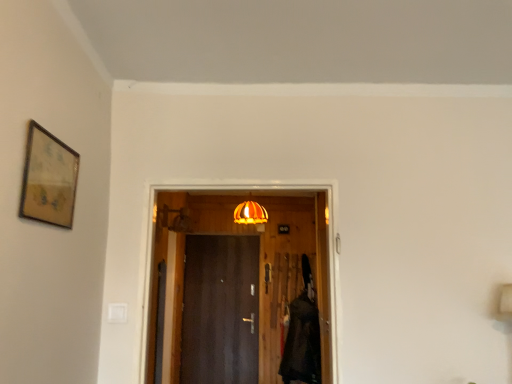
At what (x,y) coordinates should I click in order to perform the action: click on wooden-framed artwork at upper left. Please return your answer as a coordinate pair (x, y). This screenshot has width=512, height=384. Looking at the image, I should click on (49, 179).

From a real-world perspective, is dark wood door at center, the first door from the bottom, positioned above or below wooden door at center, the second door when ordered from bottom to top?

Clearly, from a real-world perspective, dark wood door at center, the first door from the bottom, is below wooden door at center, the second door when ordered from bottom to top.

Can you tell me how much dark wood door at center, acting as the 1th door starting from the back, and wooden door at center, arranged as the 1th door when viewed from the front, differ in facing direction?

1.3 degrees separate the facing orientations of dark wood door at center, acting as the 1th door starting from the back, and wooden door at center, arranged as the 1th door when viewed from the front.

Is dark wood door at center, the first door from the bottom, touching wooden door at center, the second door when ordered from bottom to top?

dark wood door at center, the first door from the bottom, and wooden door at center, the second door when ordered from bottom to top, are not in contact.

Which of these two, wooden door at center, which ranks as the first door in top-to-bottom order, or dark wood door at center, acting as the 1th door starting from the back, is thinner?

dark wood door at center, acting as the 1th door starting from the back.

How far apart are wooden door at center, the second door from the back, and dark wood door at center, acting as the 1th door starting from the back?

They are 10.91 inches apart.

Where is `door that is under the wooden door at center, the second door from the back (from a real-world perspective)`? door that is under the wooden door at center, the second door from the back (from a real-world perspective) is located at coordinates (220, 310).

Is wooden door at center, the second door when ordered from bottom to top, shorter than dark wood door at center, the 2th door when ordered from front to back?

Indeed, wooden door at center, the second door when ordered from bottom to top, has a lesser height compared to dark wood door at center, the 2th door when ordered from front to back.

Is wooden door at center, the second door when ordered from bottom to top, facing towards wooden-framed artwork at upper left?

No, wooden door at center, the second door when ordered from bottom to top, is not oriented towards wooden-framed artwork at upper left.

How many degrees apart are the facing directions of wooden door at center, the second door when ordered from bottom to top, and wooden-framed artwork at upper left?

91.2 degrees separate the facing orientations of wooden door at center, the second door when ordered from bottom to top, and wooden-framed artwork at upper left.

Does point (293, 253) lie behind point (22, 192)?

Yes, it is behind point (22, 192).

Does dark wood door at center, the first door from the bottom, have a lesser height compared to velvet black robe at right?

Incorrect, the height of dark wood door at center, the first door from the bottom, does not fall short of that of velvet black robe at right.

Could you tell me if dark wood door at center, the first door from the bottom, is turned towards velvet black robe at right?

No.

Are dark wood door at center, the 2th door when ordered from front to back, and velvet black robe at right far apart?

They are positioned close to each other.

Does wooden-framed artwork at upper left come in front of wooden door at center, the second door when ordered from bottom to top?

Yes, the depth of wooden-framed artwork at upper left is less than that of wooden door at center, the second door when ordered from bottom to top.

From the image's perspective, would you say wooden-framed artwork at upper left is positioned over wooden door at center, arranged as the 1th door when viewed from the front?

Correct, wooden-framed artwork at upper left appears higher than wooden door at center, arranged as the 1th door when viewed from the front, in the image.

Is wooden-framed artwork at upper left oriented towards wooden door at center, which ranks as the first door in top-to-bottom order?

No, wooden-framed artwork at upper left is not aimed at wooden door at center, which ranks as the first door in top-to-bottom order.

Considering the points (58, 139) and (291, 361), which point is behind, point (58, 139) or point (291, 361)?

The point (291, 361) is farther from the camera.

Where is `picture frame in front of the velvet black robe at right`? The width and height of the screenshot is (512, 384). picture frame in front of the velvet black robe at right is located at coordinates (49, 179).

In the image, is wooden-framed artwork at upper left on the left side or the right side of velvet black robe at right?

wooden-framed artwork at upper left is positioned on velvet black robe at right's left side.

How distant is wooden-framed artwork at upper left from velvet black robe at right?

The distance of wooden-framed artwork at upper left from velvet black robe at right is 3.54 meters.

Is wooden-framed artwork at upper left bigger than velvet black robe at right?

No, wooden-framed artwork at upper left is not bigger than velvet black robe at right.

Is velvet black robe at right far from wooden-framed artwork at upper left?

→ Yes, velvet black robe at right and wooden-framed artwork at upper left are quite far apart.

Visually, is velvet black robe at right positioned to the left or to the right of wooden-framed artwork at upper left?

From the image, it's evident that velvet black robe at right is to the right of wooden-framed artwork at upper left.

Would you say velvet black robe at right is outside wooden-framed artwork at upper left?

Indeed, velvet black robe at right is completely outside wooden-framed artwork at upper left.

Based on the photo, considering the sizes of objects velvet black robe at right and wooden-framed artwork at upper left in the image provided, who is wider, velvet black robe at right or wooden-framed artwork at upper left?

Wider between the two is velvet black robe at right.

Identify the location of door above the dark wood door at center, arranged as the 2th door when viewed from the top (from the image's perspective). (239, 290).

At what (x,y) coordinates should I click in order to perform the action: click on door behind the wooden door at center, which ranks as the first door in top-to-bottom order. Please return your answer as a coordinate pair (x, y). Looking at the image, I should click on (220, 310).

Which object lies further to the anchor point dark wood door at center, the first door from the bottom, wooden door at center, the second door when ordered from bottom to top, or velvet black robe at right?

Among the two, velvet black robe at right is located further to dark wood door at center, the first door from the bottom.

When comparing their distances from velvet black robe at right, does orange glass lampshade at center or wooden-framed artwork at upper left seem closer?

orange glass lampshade at center is closer to velvet black robe at right.

Looking at the image, which one is located further to wooden door at center, arranged as the 1th door when viewed from the front, velvet black robe at right or wooden-framed artwork at upper left?

Among the two, wooden-framed artwork at upper left is located further to wooden door at center, arranged as the 1th door when viewed from the front.

Considering their positions, is dark wood door at center, arranged as the 2th door when viewed from the top, positioned closer to orange glass lampshade at center than wooden-framed artwork at upper left?

The object closer to orange glass lampshade at center is dark wood door at center, arranged as the 2th door when viewed from the top.

When comparing their distances from wooden door at center, the second door when ordered from bottom to top, does dark wood door at center, acting as the 1th door starting from the back, or orange glass lampshade at center seem further?

orange glass lampshade at center is positioned further to the anchor wooden door at center, the second door when ordered from bottom to top.

In the scene shown: Looking at the image, which one is located further to wooden-framed artwork at upper left, wooden door at center, the second door from the back, or dark wood door at center, arranged as the 2th door when viewed from the top?

Based on the image, dark wood door at center, arranged as the 2th door when viewed from the top, appears to be further to wooden-framed artwork at upper left.

Based on their spatial positions, is wooden-framed artwork at upper left or velvet black robe at right closer to wooden door at center, the second door from the back?

Among the two, velvet black robe at right is located nearer to wooden door at center, the second door from the back.

When comparing their distances from velvet black robe at right, does wooden door at center, which ranks as the first door in top-to-bottom order, or wooden-framed artwork at upper left seem closer?

Among the two, wooden door at center, which ranks as the first door in top-to-bottom order, is located nearer to velvet black robe at right.

I want to click on lamp located between wooden-framed artwork at upper left and velvet black robe at right in the depth direction, so click(250, 213).

Find the location of `lamp located between wooden door at center, the second door when ordered from bottom to top, and dark wood door at center, the 2th door when ordered from front to back, in the depth direction`. lamp located between wooden door at center, the second door when ordered from bottom to top, and dark wood door at center, the 2th door when ordered from front to back, in the depth direction is located at coordinates (250, 213).

You are a GUI agent. You are given a task and a screenshot of the screen. Output one action in this format:
    pyautogui.click(x=<x>, y=<y>)
    Task: Click on the lamp between wooden-framed artwork at upper left and dark wood door at center, acting as the 1th door starting from the back, in the front-back direction
    Image resolution: width=512 pixels, height=384 pixels.
    Given the screenshot: What is the action you would take?
    click(x=250, y=213)

You are a GUI agent. You are given a task and a screenshot of the screen. Output one action in this format:
    pyautogui.click(x=<x>, y=<y>)
    Task: Click on the door between wooden-framed artwork at upper left and orange glass lampshade at center along the z-axis
    The width and height of the screenshot is (512, 384).
    Given the screenshot: What is the action you would take?
    pyautogui.click(x=239, y=290)